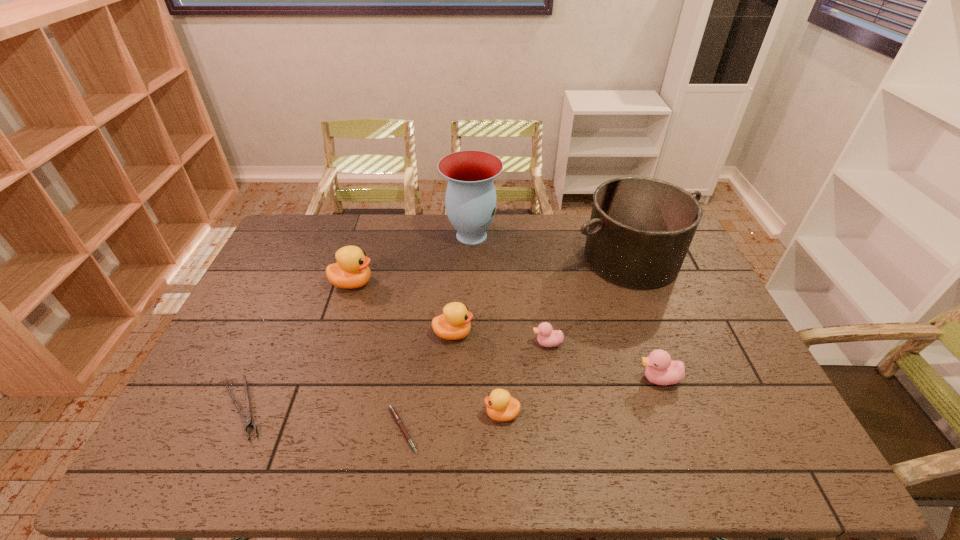
This screenshot has height=540, width=960. I want to click on the tallest object, so click(x=471, y=202).

Where is `red vase`? Image resolution: width=960 pixels, height=540 pixels. red vase is located at coordinates (471, 202).

The image size is (960, 540). I want to click on the second tallest object, so click(x=640, y=230).

Where is `the leftmost yellow duckling`? The image size is (960, 540). the leftmost yellow duckling is located at coordinates (351, 271).

You are a GUI agent. You are given a task and a screenshot of the screen. Output one action in this format:
    pyautogui.click(x=<x>, y=<y>)
    Task: Click on the eighth object from right to left
    
    Given the screenshot: What is the action you would take?
    pyautogui.click(x=351, y=271)

You are a GUI agent. You are given a task and a screenshot of the screen. Output one action in this format:
    pyautogui.click(x=<x>, y=<y>)
    Task: Click on the fourth duckling from right to left
    This screenshot has height=540, width=960.
    Given the screenshot: What is the action you would take?
    pyautogui.click(x=454, y=323)

Locate an element on the screen. The image size is (960, 540). the second biggest yellow duckling is located at coordinates (454, 323).

Locate an element on the screen. The image size is (960, 540). the right pink duckling is located at coordinates (660, 369).

What are the coordinates of `the nearer pink duckling` in the screenshot? It's located at (660, 369).

Identify the location of the rightmost yellow duckling. The width and height of the screenshot is (960, 540). (500, 406).